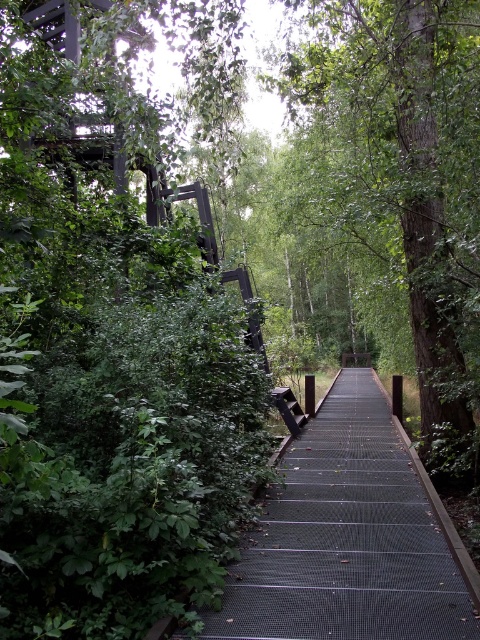
Is green leafy tree at center to the right of black mesh staircase at center from the viewer's perspective?

Indeed, green leafy tree at center is positioned on the right side of black mesh staircase at center.

Does green leafy tree at center have a lesser width compared to black mesh staircase at center?

No.

Identify the location of green leafy tree at center. (406, 180).

I want to click on green leafy tree at center, so click(406, 180).